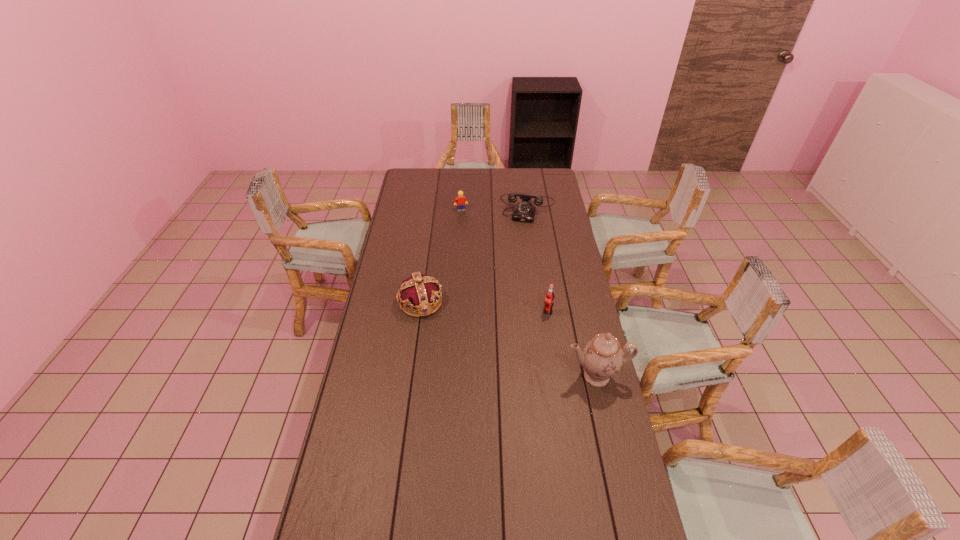
Identify the location of vacant area between the second object from left to right and the chinaware. (529, 293).

The image size is (960, 540). Find the location of `blank region between the second object from left to right and the chinaware`. blank region between the second object from left to right and the chinaware is located at coordinates (529, 293).

Image resolution: width=960 pixels, height=540 pixels. Identify the location of vacant space that's between the nearest object and the leftmost object. (x=509, y=339).

The width and height of the screenshot is (960, 540). What are the coordinates of `unoccupied area between the soda bottle and the crown` in the screenshot? It's located at (484, 307).

The image size is (960, 540). Identify the location of empty space that is in between the nearest object and the telephone. (563, 293).

Locate an element on the screen. free spot between the nearest object and the telephone is located at coordinates (563, 293).

I want to click on object that is the closest to the tallest object, so pyautogui.click(x=549, y=297).

Identify which object is the fourth closest to the telephone. Please provide its 2D coordinates. Your answer should be formatted as a tuple, i.e. [(x, y)], where the tuple contains the x and y coordinates of a point satisfying the conditions above.

[(602, 357)]